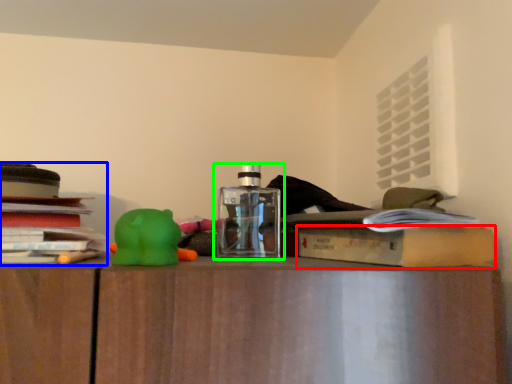
Question: Based on their relative distances, which object is nearer to paperback book (highlighted by a red box)? Choose from book (highlighted by a blue box) and bottle (highlighted by a green box).

Choices:
 (A) book
 (B) bottle

Answer: (B)